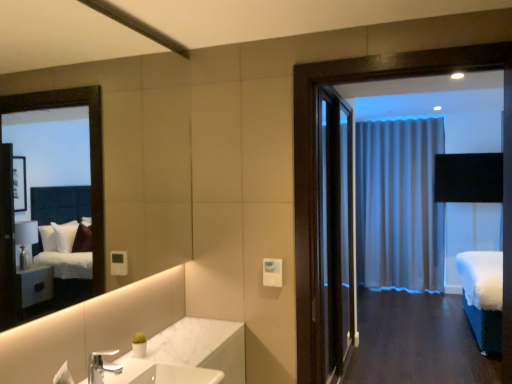
Question: Is white fabric bed at right inside the boundaries of dark wood door at center, or outside?

Choices:
 (A) inside
 (B) outside

Answer: (B)

Question: From a real-world perspective, relative to dark wood door at center, is white fabric bed at right vertically above or below?

Choices:
 (A) above
 (B) below

Answer: (B)

Question: Estimate the real-world distances between objects in this image. Which object is farther from the white marble sink at lower center?

Choices:
 (A) white fabric bed at right
 (B) silky gray curtain at center
 (C) dark wood door at center
 (D) silver metallic faucet at lower left

Answer: (B)

Question: Based on their relative distances, which object is farther from the silver metallic faucet at lower left?

Choices:
 (A) white marble sink at lower center
 (B) white fabric bed at right
 (C) dark wood door at center
 (D) silky gray curtain at center

Answer: (D)